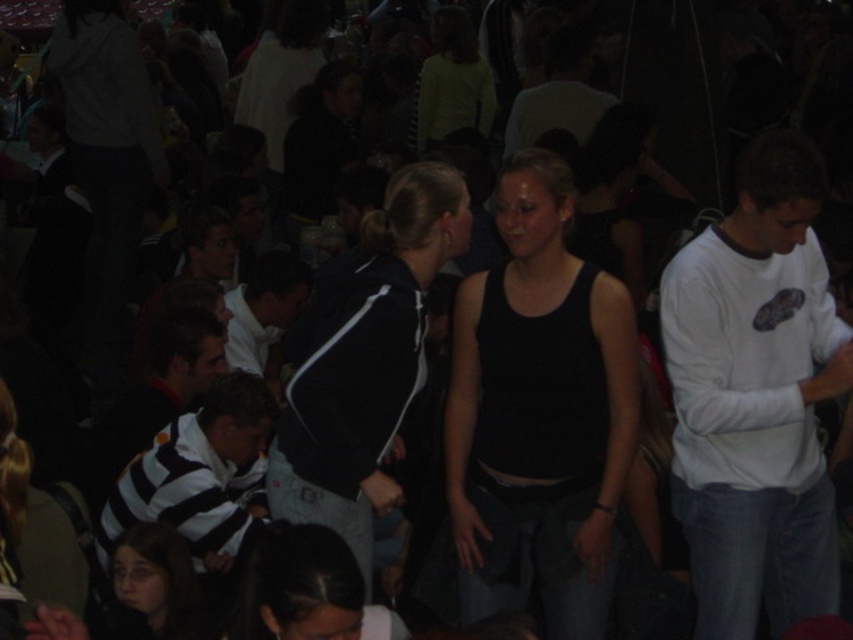
Question: Which object is closer to the camera taking this photo?

Choices:
 (A) striped jersey shirt at lower left
 (B) black matte tank top at center

Answer: (B)

Question: Can you confirm if striped jersey at center is smaller than dark brown hair at lower left?

Choices:
 (A) yes
 (B) no

Answer: (B)

Question: Does black fabric jacket at center have a larger size compared to striped jersey at center?

Choices:
 (A) no
 (B) yes

Answer: (B)

Question: Which point is closer to the camera?

Choices:
 (A) (247, 346)
 (B) (363, 342)

Answer: (B)

Question: Which of the following is the closest to the observer?

Choices:
 (A) (486, 490)
 (B) (119, 556)

Answer: (B)

Question: Can you confirm if striped jersey shirt at lower left is positioned to the right of dark brown hair at lower left?

Choices:
 (A) yes
 (B) no

Answer: (A)